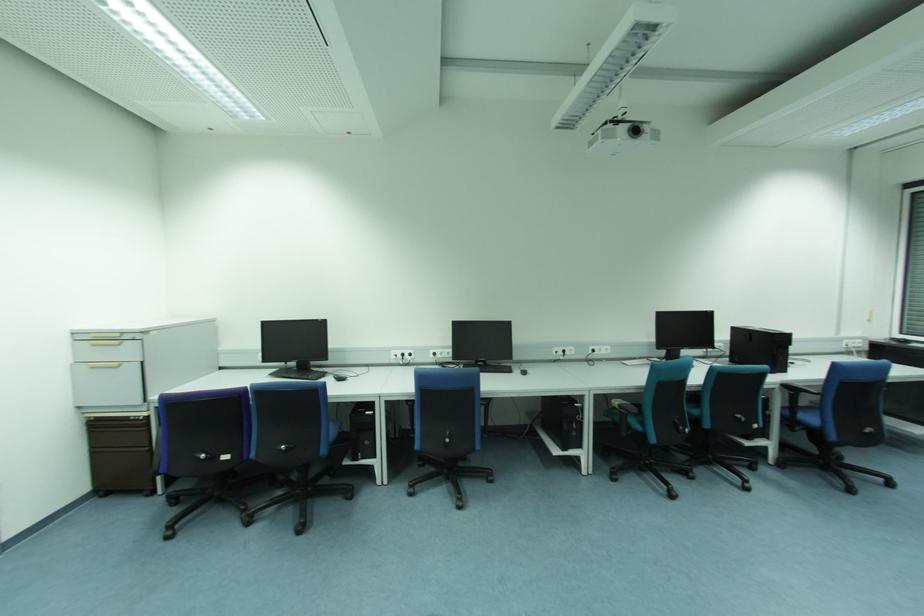
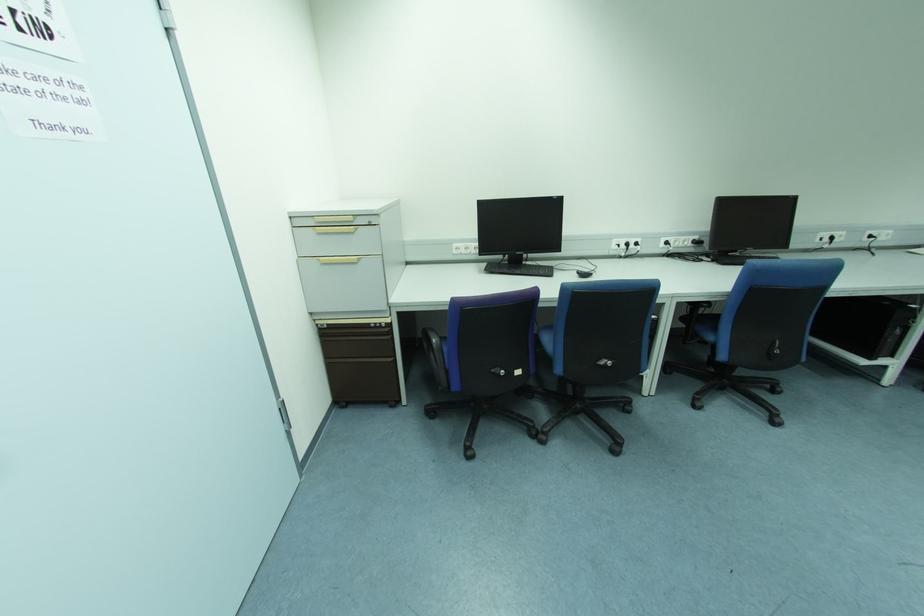
Question: I am providing you with two images of the same scene from different viewpoints. Which of the following objects are not visible in image2?

Choices:
 (A) black computer mouse
 (B) black chair armrest
 (C) chair adjustment lever
 (D) none of these

Answer: (D)